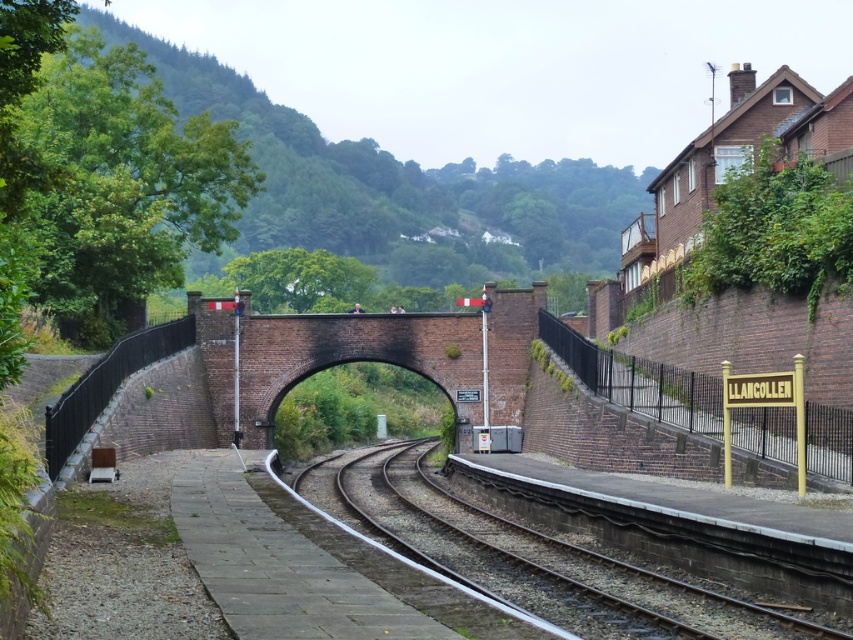
Is smooth metal tracks at center thinner than gold metallic sign at right?

Incorrect, smooth metal tracks at center's width is not less than gold metallic sign at right's.

Between point (683, 584) and point (570, 346), which one is positioned in front?

Point (683, 584) is in front.

Who is more forward, [682,618] or [851,460]?

Positioned in front is point [682,618].

Where is `smooth metal tracks at center`? The width and height of the screenshot is (853, 640). smooth metal tracks at center is located at coordinates (573, 554).

Is brick archway at center bigger than smooth metal tracks at center?

Correct, brick archway at center is larger in size than smooth metal tracks at center.

Find the location of a particular element. brick archway at center is located at coordinates (579, 406).

You are a GUI agent. You are given a task and a screenshot of the screen. Output one action in this format:
    pyautogui.click(x=<x>, y=<y>)
    Task: Click on the brick archway at center
    
    Given the screenshot: What is the action you would take?
    pyautogui.click(x=579, y=406)

Which is in front, point (280, 364) or point (543, 317)?

Point (543, 317) is more forward.

Can you confirm if brick archway at center is thinner than gold metallic sign at right?

No.

Is point (252, 412) in front of point (805, 417)?

No, (252, 412) is behind (805, 417).

Image resolution: width=853 pixels, height=640 pixels. What are the coordinates of `brick archway at center` in the screenshot? It's located at (579, 406).